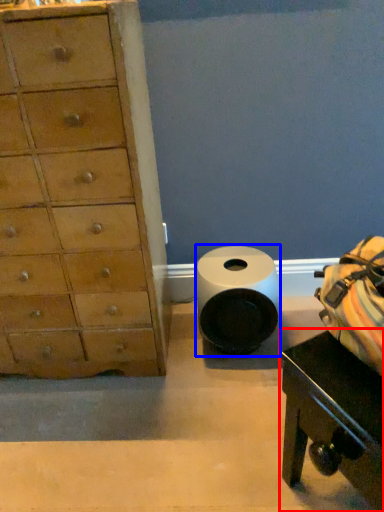
Question: Which of the following is the closest to the observer, table (highlighted by a red box) or toilet paper (highlighted by a blue box)?

Choices:
 (A) table
 (B) toilet paper

Answer: (A)